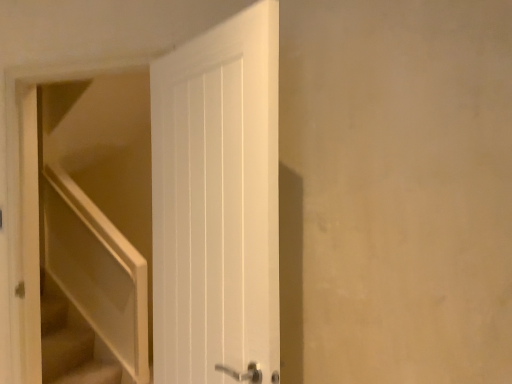
Question: From the image's perspective, is beige carpeted stairs at lower left on top of white matte door at left?

Choices:
 (A) yes
 (B) no

Answer: (B)

Question: From a real-world perspective, is beige carpeted stairs at lower left below white matte door at left?

Choices:
 (A) yes
 (B) no

Answer: (A)

Question: From a real-world perspective, is beige carpeted stairs at lower left on white matte door at left?

Choices:
 (A) no
 (B) yes

Answer: (A)

Question: Is the position of beige carpeted stairs at lower left more distant than that of white matte door at left?

Choices:
 (A) no
 (B) yes

Answer: (B)

Question: Does beige carpeted stairs at lower left have a greater height compared to white matte door at left?

Choices:
 (A) no
 (B) yes

Answer: (A)

Question: Considering the relative sizes of beige carpeted stairs at lower left and white matte door at left in the image provided, is beige carpeted stairs at lower left wider than white matte door at left?

Choices:
 (A) yes
 (B) no

Answer: (A)

Question: Is white matte door at left surrounding beige carpeted stairs at lower left?

Choices:
 (A) no
 (B) yes

Answer: (A)

Question: From a real-world perspective, is white matte door at left positioned under beige carpeted stairs at lower left based on gravity?

Choices:
 (A) yes
 (B) no

Answer: (B)

Question: Is white matte door at left bigger than beige carpeted stairs at lower left?

Choices:
 (A) no
 (B) yes

Answer: (B)

Question: Considering the relative sizes of white matte door at left and beige carpeted stairs at lower left in the image provided, is white matte door at left thinner than beige carpeted stairs at lower left?

Choices:
 (A) yes
 (B) no

Answer: (A)

Question: From a real-world perspective, is white matte door at left located higher than beige carpeted stairs at lower left?

Choices:
 (A) no
 (B) yes

Answer: (B)

Question: Is white matte door at left taller than beige carpeted stairs at lower left?

Choices:
 (A) yes
 (B) no

Answer: (A)

Question: From a real-world perspective, is beige carpeted stairs at lower left physically located above or below white matte door at left?

Choices:
 (A) below
 (B) above

Answer: (A)